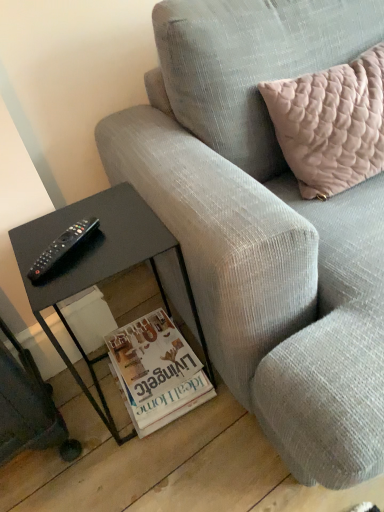
You are a GUI agent. You are given a task and a screenshot of the screen. Output one action in this format:
    pyautogui.click(x=<x>, y=<y>)
    Task: Click on the pale pink quilted cushion at upper right
    The image size is (384, 512).
    Given the screenshot: What is the action you would take?
    pyautogui.click(x=331, y=124)

Find the location of `white glossy magazine at lower center`. white glossy magazine at lower center is located at coordinates (157, 372).

I want to click on black plastic remote at left, so click(x=61, y=248).

Find the location of `black glass table at lower left`. black glass table at lower left is located at coordinates (97, 266).

Measure the distance between point (222, 24) and camera.

The depth of point (222, 24) is 3.37 feet.

Where is `pale pink quilted cushion at upper right`? pale pink quilted cushion at upper right is located at coordinates (331, 124).

Which of these two, pale pink quilted cushion at upper right or black glass table at lower left, is thinner?

With smaller width is pale pink quilted cushion at upper right.

Does point (363, 172) appear closer or farther from the camera than point (91, 364)?

Point (363, 172).

From a real-world perspective, which object stands above the other?

pale pink quilted cushion at upper right is physically above.

From the image's perspective, is pale pink quilted cushion at upper right above black glass table at lower left?

Indeed, from the image's perspective, pale pink quilted cushion at upper right is shown above black glass table at lower left.

Can you confirm if black glass table at lower left is thinner than pale pink quilted cushion at upper right?

No, black glass table at lower left is not thinner than pale pink quilted cushion at upper right.

Measure the distance between black glass table at lower left and pale pink quilted cushion at upper right.

21.34 inches.

Is black glass table at lower left located outside pale pink quilted cushion at upper right?

black glass table at lower left is positioned outside pale pink quilted cushion at upper right.

Is black glass table at lower left facing towards pale pink quilted cushion at upper right?

No, black glass table at lower left does not turn towards pale pink quilted cushion at upper right.

Is gray corduroy couch at center not close to white glossy magazine at lower center?

No.

Considering the sizes of gray corduroy couch at center and white glossy magazine at lower center in the image, is gray corduroy couch at center taller or shorter than white glossy magazine at lower center?

Clearly, gray corduroy couch at center is taller compared to white glossy magazine at lower center.

From a real-world perspective, who is located lower, gray corduroy couch at center or white glossy magazine at lower center?

white glossy magazine at lower center, from a real-world perspective.

Considering the sizes of objects gray corduroy couch at center and white glossy magazine at lower center in the image provided, who is thinner, gray corduroy couch at center or white glossy magazine at lower center?

Thinner between the two is white glossy magazine at lower center.

Can you see black plastic remote at left touching white glossy magazine at lower center?

No, black plastic remote at left is not making contact with white glossy magazine at lower center.

From the image's perspective, is black plastic remote at left located above or below white glossy magazine at lower center?

From the image's perspective, black plastic remote at left appears above white glossy magazine at lower center.

From their relative heights in the image, would you say black plastic remote at left is taller or shorter than white glossy magazine at lower center?

In the image, black plastic remote at left appears to be shorter than white glossy magazine at lower center.

Does black glass table at lower left have a greater height compared to black plastic remote at left?

Correct, black glass table at lower left is much taller as black plastic remote at left.

Looking at this image, how many degrees apart are the facing directions of black glass table at lower left and black plastic remote at left?

The facing directions of black glass table at lower left and black plastic remote at left are 26.2 degrees apart.

Considering the relative sizes of black glass table at lower left and black plastic remote at left in the image provided, is black glass table at lower left wider than black plastic remote at left?

Yes.

Which is more to the right, black glass table at lower left or black plastic remote at left?

From the viewer's perspective, black glass table at lower left appears more on the right side.

Is gray corduroy couch at center directly adjacent to pale pink quilted cushion at upper right?

No, gray corduroy couch at center is not touching pale pink quilted cushion at upper right.

Is gray corduroy couch at center oriented away from pale pink quilted cushion at upper right?

Yes, gray corduroy couch at center is facing away from pale pink quilted cushion at upper right.

What's the angular difference between gray corduroy couch at center and pale pink quilted cushion at upper right's facing directions?

The facing directions of gray corduroy couch at center and pale pink quilted cushion at upper right are 0.000122 degrees apart.

From the image's perspective, who appears lower, gray corduroy couch at center or pale pink quilted cushion at upper right?

gray corduroy couch at center, from the image's perspective.

From the image's perspective, does gray corduroy couch at center appear higher than black glass table at lower left?

Yes, from the image's perspective, gray corduroy couch at center is on top of black glass table at lower left.

Measure the distance between gray corduroy couch at center and black glass table at lower left.

gray corduroy couch at center is 10.59 inches away from black glass table at lower left.

Can you confirm if gray corduroy couch at center is smaller than black glass table at lower left?

No.

Would you consider gray corduroy couch at center to be distant from black glass table at lower left?

Actually, gray corduroy couch at center and black glass table at lower left are a little close together.

Locate an element on the screen. table in front of the pale pink quilted cushion at upper right is located at coordinates click(x=97, y=266).

Find the location of a particular element. This screenshot has height=512, width=384. throw pillow above the black glass table at lower left (from the image's perspective) is located at coordinates (331, 124).

When comparing their distances from black plastic remote at left, does pale pink quilted cushion at upper right or gray corduroy couch at center seem further?

The object further to black plastic remote at left is pale pink quilted cushion at upper right.

From the image, which object appears to be nearer to black plastic remote at left, gray corduroy couch at center or white glossy magazine at lower center?

The object closer to black plastic remote at left is gray corduroy couch at center.

Estimate the real-world distances between objects in this image. Which object is further from black plastic remote at left, gray corduroy couch at center or pale pink quilted cushion at upper right?

pale pink quilted cushion at upper right is further to black plastic remote at left.

Considering their positions, is black glass table at lower left positioned closer to white glossy magazine at lower center than gray corduroy couch at center?

black glass table at lower left lies closer to white glossy magazine at lower center than the other object.

From the image, which object appears to be farther from gray corduroy couch at center, white glossy magazine at lower center or pale pink quilted cushion at upper right?

white glossy magazine at lower center is positioned further to the anchor gray corduroy couch at center.

When comparing their distances from white glossy magazine at lower center, does pale pink quilted cushion at upper right or gray corduroy couch at center seem further?

pale pink quilted cushion at upper right is further to white glossy magazine at lower center.

Which object lies nearer to the anchor point black glass table at lower left, white glossy magazine at lower center or gray corduroy couch at center?

The object closer to black glass table at lower left is gray corduroy couch at center.

When comparing their distances from black glass table at lower left, does gray corduroy couch at center or pale pink quilted cushion at upper right seem further?

pale pink quilted cushion at upper right is positioned further to the anchor black glass table at lower left.

Find the location of a particular element. This screenshot has width=384, height=512. throw pillow between gray corduroy couch at center and white glossy magazine at lower center along the z-axis is located at coordinates (331, 124).

In order to click on table between black plastic remote at left and pale pink quilted cushion at upper right in this screenshot , I will do `click(97, 266)`.

Find the location of a particular element. The image size is (384, 512). throw pillow between black glass table at lower left and gray corduroy couch at center from left to right is located at coordinates (331, 124).

At what (x,y) coordinates should I click in order to perform the action: click on remote positioned between black glass table at lower left and white glossy magazine at lower center from near to far. Please return your answer as a coordinate pair (x, y). The width and height of the screenshot is (384, 512). Looking at the image, I should click on (61, 248).